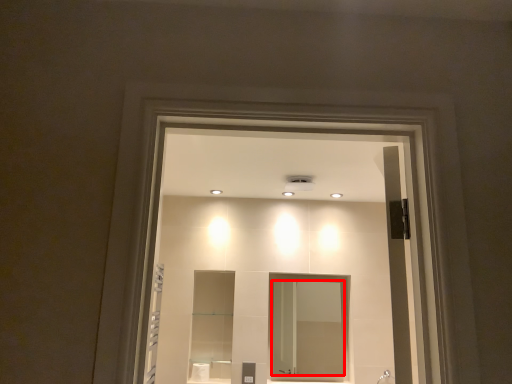
Question: Considering the relative positions of mirror (annotated by the red box) and shower in the image provided, where is mirror (annotated by the red box) located with respect to the staircase?

Choices:
 (A) right
 (B) left

Answer: (B)